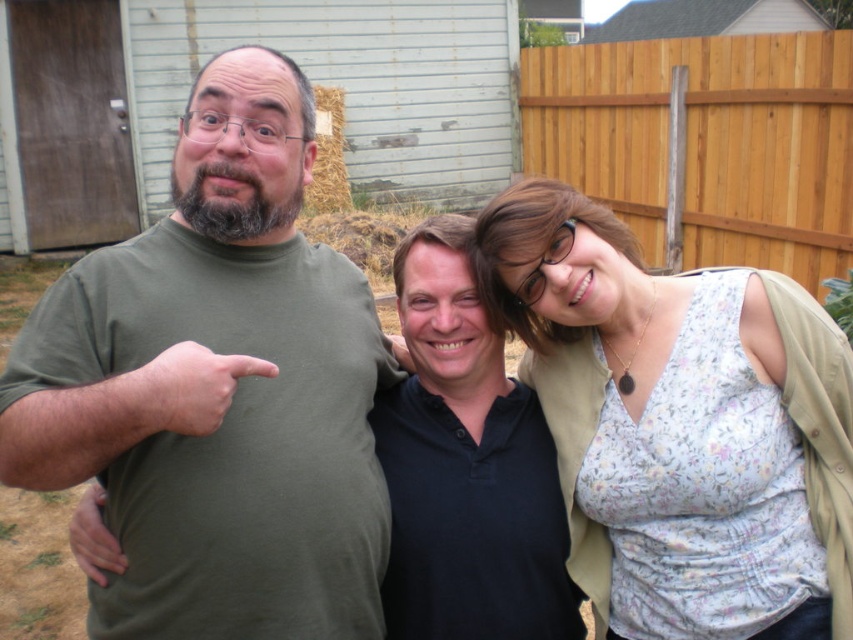
Does green matte t-shirt at left have a smaller size compared to green matte shirt at left?

No, green matte t-shirt at left is not smaller than green matte shirt at left.

Is point (273, 460) positioned before point (630, 404)?

That is True.

Is point (251, 122) in front of point (703, 496)?

Yes, point (251, 122) is closer to viewer.

Where is `green matte t-shirt at left`? This screenshot has height=640, width=853. green matte t-shirt at left is located at coordinates (218, 388).

Does green matte t-shirt at left lie in front of floral fabric blouse at upper right?

Yes.

Consider the image. Can you confirm if green matte t-shirt at left is shorter than floral fabric blouse at upper right?

No.

Which is in front, point (361, 406) or point (746, 525)?

Positioned in front is point (746, 525).

Where is `green matte t-shirt at left`? This screenshot has width=853, height=640. green matte t-shirt at left is located at coordinates (218, 388).

Can you confirm if green matte shirt at left is shorter than wooden fence at upper right?

Yes, green matte shirt at left is shorter than wooden fence at upper right.

Is green matte shirt at left positioned at the back of wooden fence at upper right?

No, it is not.

Describe the element at coordinates (677, 416) in the screenshot. I see `green matte shirt at left` at that location.

Where is `green matte shirt at left`? This screenshot has width=853, height=640. green matte shirt at left is located at coordinates (677, 416).